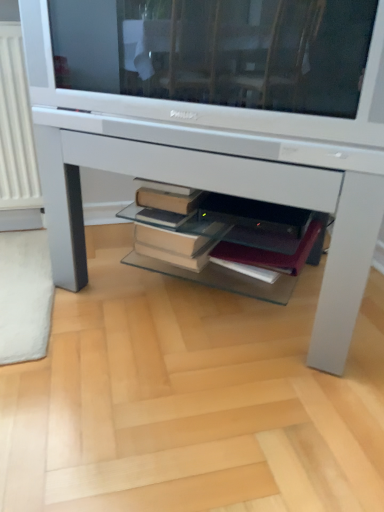
Question: Is white glossy television at upper center at the left side of white glossy desk at center?

Choices:
 (A) no
 (B) yes

Answer: (B)

Question: Could you tell me if white glossy television at upper center is facing white glossy desk at center?

Choices:
 (A) yes
 (B) no

Answer: (B)

Question: Is white glossy desk at center at the back of white glossy television at upper center?

Choices:
 (A) yes
 (B) no

Answer: (B)

Question: From the image's perspective, is white glossy television at upper center above white glossy desk at center?

Choices:
 (A) yes
 (B) no

Answer: (A)

Question: Does white glossy television at upper center appear on the right side of white glossy desk at center?

Choices:
 (A) no
 (B) yes

Answer: (A)

Question: From a real-world perspective, relative to white glossy desk at center, is white glossy television at upper center vertically above or below?

Choices:
 (A) below
 (B) above

Answer: (B)

Question: Looking at their shapes, would you say white glossy television at upper center is wider or thinner than white glossy desk at center?

Choices:
 (A) wide
 (B) thin

Answer: (B)

Question: Is white glossy television at upper center taller or shorter than white glossy desk at center?

Choices:
 (A) short
 (B) tall

Answer: (A)

Question: In the image, is white glossy television at upper center positioned in front of or behind white glossy desk at center?

Choices:
 (A) behind
 (B) front

Answer: (B)

Question: Considering the positions of white glossy television at upper center and maroon leather notebook at center in the image, is white glossy television at upper center wider or thinner than maroon leather notebook at center?

Choices:
 (A) thin
 (B) wide

Answer: (B)

Question: In terms of height, does white glossy television at upper center look taller or shorter compared to maroon leather notebook at center?

Choices:
 (A) tall
 (B) short

Answer: (A)

Question: Choose the correct answer: Is white glossy television at upper center inside maroon leather notebook at center or outside it?

Choices:
 (A) inside
 (B) outside

Answer: (B)

Question: Relative to maroon leather notebook at center, is white glossy television at upper center in front or behind?

Choices:
 (A) behind
 (B) front

Answer: (B)

Question: Is maroon leather notebook at center taller or shorter than white glossy television at upper center?

Choices:
 (A) tall
 (B) short

Answer: (B)

Question: Do you think maroon leather notebook at center is within white glossy television at upper center, or outside of it?

Choices:
 (A) inside
 (B) outside

Answer: (B)